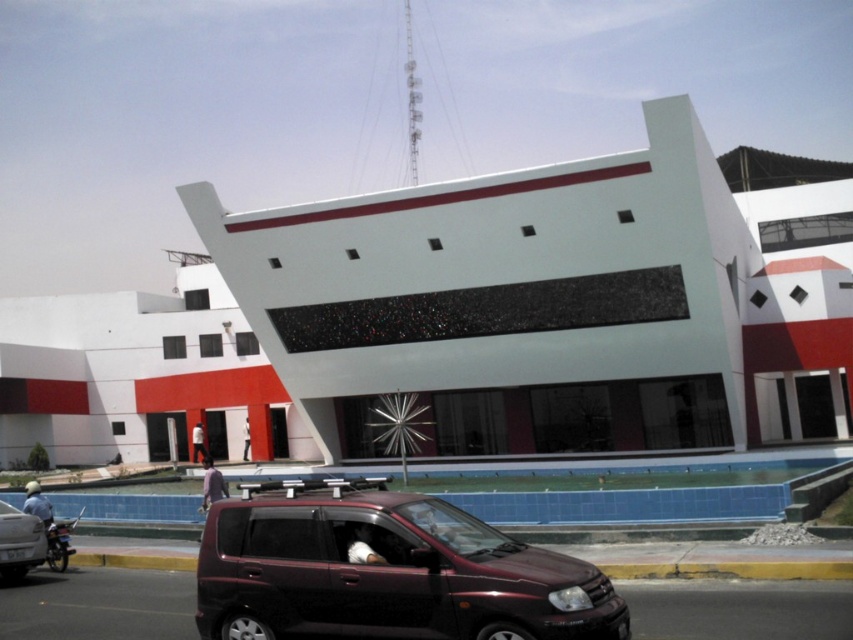
You are a delivery driver who needs to park your vehicle in the parking lot behind the shiny maroon minivan at center and the matte black car at lower left. Can you safely drive your truck between these two vehicles to reach the parking spot?

The shiny maroon minivan at center is positioned under the matte black car at lower left, which suggests they are stacked vertically rather than side by side. Since the minivan is under the car, there is no space between them for the truck to pass through. Therefore, you cannot safely drive your truck between the shiny maroon minivan at center and the matte black car at lower left to reach the parking spot.

Looking at this image, you are a delivery driver trying to park your vehicle in a tight space between the shiny maroon minivan at center and the matte black car at lower left. The space between them is only 1.8 meters tall. Can your 2.0 meter tall delivery van fit vertically between them?

The shiny maroon minivan at center is much taller than the matte black car at lower left. Since the space between them is only 1.8 meters tall and your delivery van is 2.0 meters tall, it cannot fit vertically between them.